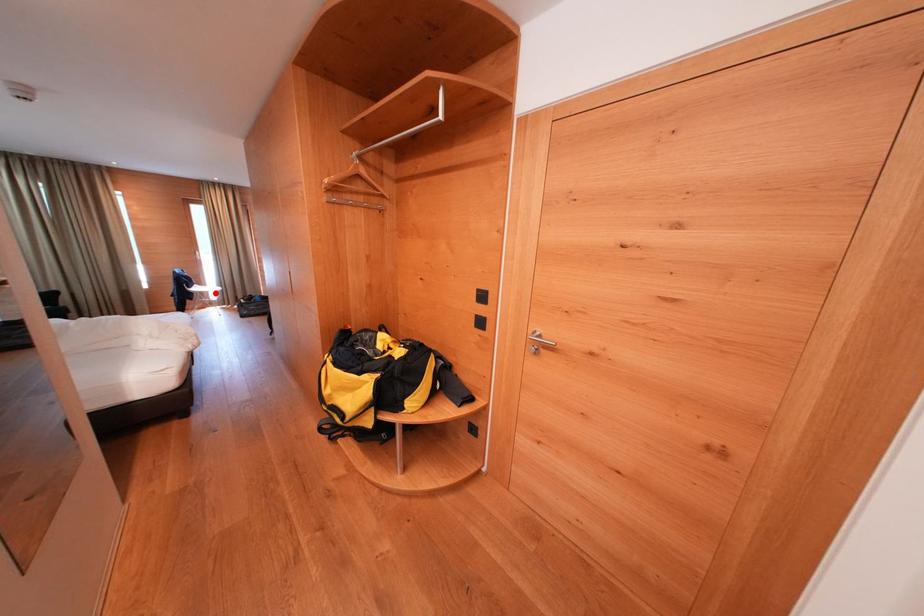
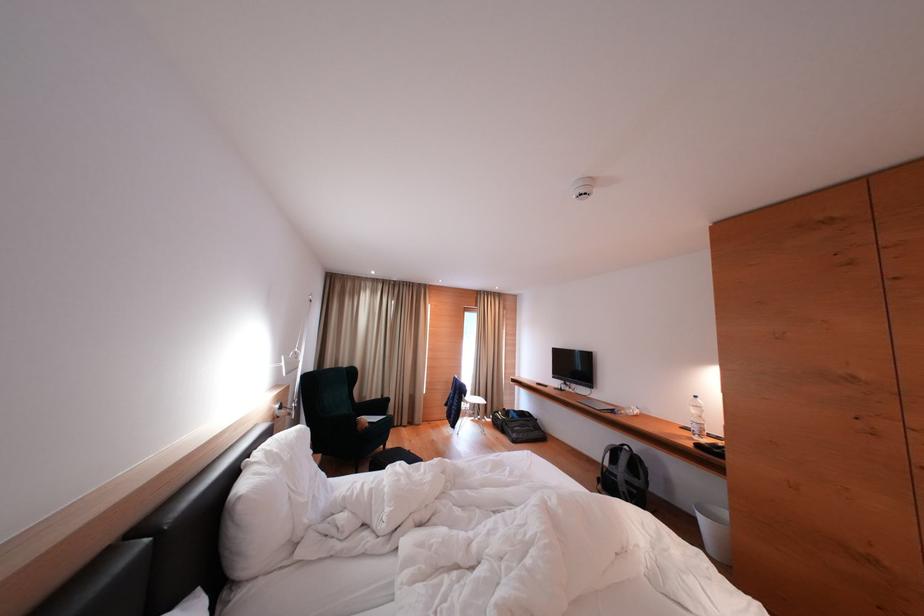
Question: I am providing you with two images of the same scene from different viewpoints. In image1, a red point is highlighted. Considering the same 3D point in image2, which of the following is correct?

Choices:
 (A) It is closer
 (B) It is farther

Answer: (B)